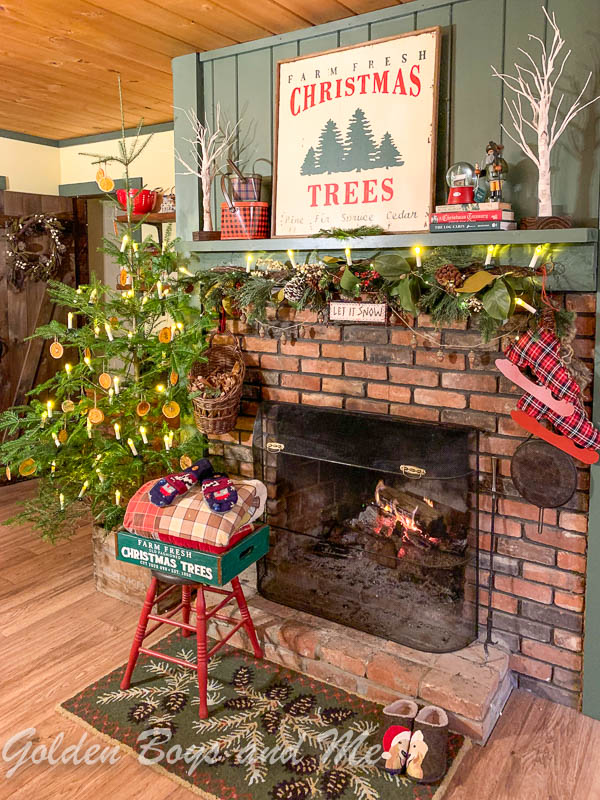
The width and height of the screenshot is (600, 800). Find the location of `slippers`. slippers is located at coordinates (425, 780), (395, 754).